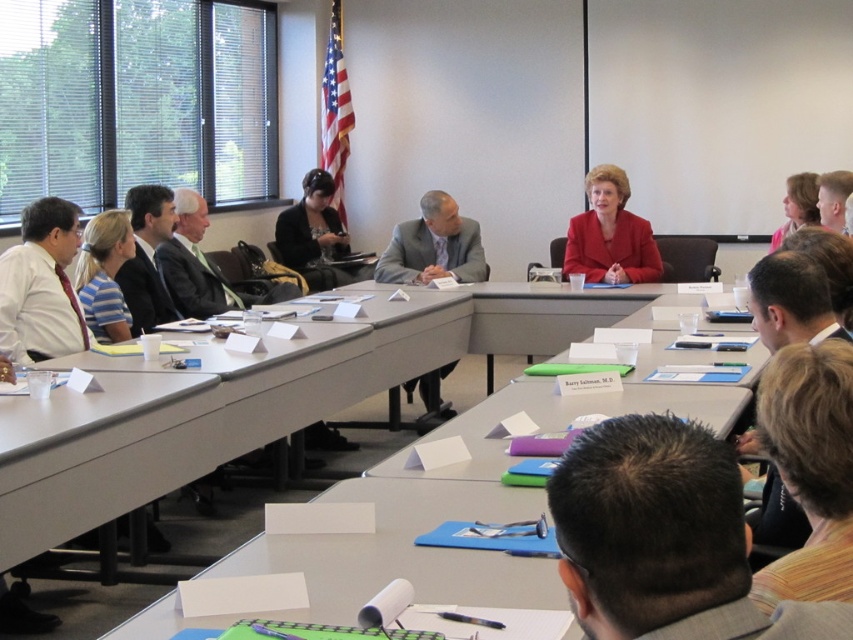
Consider the image. Measure the distance between point (x=299, y=221) and camera.

24.99 feet

How distant is black fabric jacket at center from pink fabric at upper right?

They are 3.96 meters apart.

This screenshot has width=853, height=640. I want to click on black fabric jacket at center, so click(x=317, y=236).

Locate an element on the screen. The width and height of the screenshot is (853, 640). black fabric jacket at center is located at coordinates (x=317, y=236).

Is white paper at center to the left of matte red blazer at center from the viewer's perspective?

Yes, white paper at center is to the left of matte red blazer at center.

Does white paper at center have a lesser height compared to matte red blazer at center?

Yes.

Describe the element at coordinates (405, 550) in the screenshot. The width and height of the screenshot is (853, 640). I see `white paper at center` at that location.

The width and height of the screenshot is (853, 640). What are the coordinates of `white paper at center` in the screenshot? It's located at (405, 550).

Is point (317, 552) in front of point (160, 195)?

Yes.

Which is behind, point (367, 541) or point (123, 296)?

The point (123, 296) is more distant.

Which is behind, point (473, 604) or point (142, 275)?

The point (142, 275) is behind.

At what (x,y) coordinates should I click in order to perform the action: click on white paper at center. Please return your answer as a coordinate pair (x, y). The width and height of the screenshot is (853, 640). Looking at the image, I should click on (405, 550).